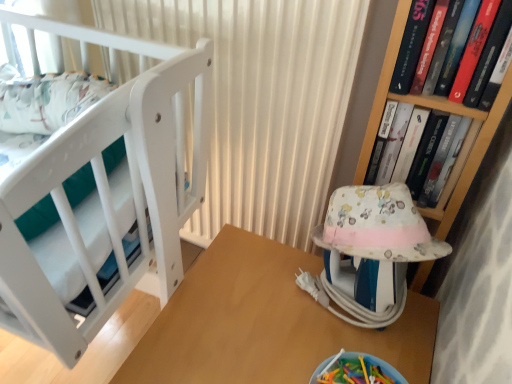
Question: From a real-world perspective, is hardcover book at upper right, positioned as the second book in back-to-front order, over wooden table at center?

Choices:
 (A) yes
 (B) no

Answer: (A)

Question: Can you confirm if hardcover book at upper right, the first book in the front-to-back sequence, is positioned to the right of wooden table at center?

Choices:
 (A) no
 (B) yes

Answer: (B)

Question: Can you confirm if hardcover book at upper right, the first book in the front-to-back sequence, is taller than wooden table at center?

Choices:
 (A) yes
 (B) no

Answer: (B)

Question: Does hardcover book at upper right, positioned as the second book in back-to-front order, touch wooden table at center?

Choices:
 (A) no
 (B) yes

Answer: (A)

Question: Does hardcover book at upper right, the first book in the front-to-back sequence, come behind wooden table at center?

Choices:
 (A) yes
 (B) no

Answer: (B)

Question: Do you think white matte crib at left is within hardcover book at upper right, the first book from the back, or outside of it?

Choices:
 (A) outside
 (B) inside

Answer: (A)

Question: Is point (76, 274) closer or farther from the camera than point (408, 137)?

Choices:
 (A) farther
 (B) closer

Answer: (B)

Question: Is white matte crib at left taller or shorter than hardcover book at upper right, the second book when ordered from front to back?

Choices:
 (A) short
 (B) tall

Answer: (B)

Question: Is white matte crib at left wider or thinner than hardcover book at upper right, the second book when ordered from front to back?

Choices:
 (A) wide
 (B) thin

Answer: (A)

Question: In terms of size, does hardcover book at upper right, the second book when ordered from front to back, appear bigger or smaller than white matte crib at left?

Choices:
 (A) big
 (B) small

Answer: (B)

Question: From the image's perspective, relative to white matte crib at left, is hardcover book at upper right, the first book from the back, above or below?

Choices:
 (A) below
 (B) above

Answer: (A)

Question: From a real-world perspective, relative to white matte crib at left, is hardcover book at upper right, the second book when ordered from front to back, vertically above or below?

Choices:
 (A) below
 (B) above

Answer: (B)

Question: Based on their positions, is hardcover book at upper right, the first book from the back, located to the left or right of white matte crib at left?

Choices:
 (A) left
 (B) right

Answer: (B)

Question: Is hardcover book at upper right, positioned as the second book in back-to-front order, inside the boundaries of fluffy fabric baby carriage at right, or outside?

Choices:
 (A) inside
 (B) outside

Answer: (B)

Question: Considering the positions of point (477, 79) and point (327, 261), is point (477, 79) closer or farther from the camera than point (327, 261)?

Choices:
 (A) closer
 (B) farther

Answer: (A)